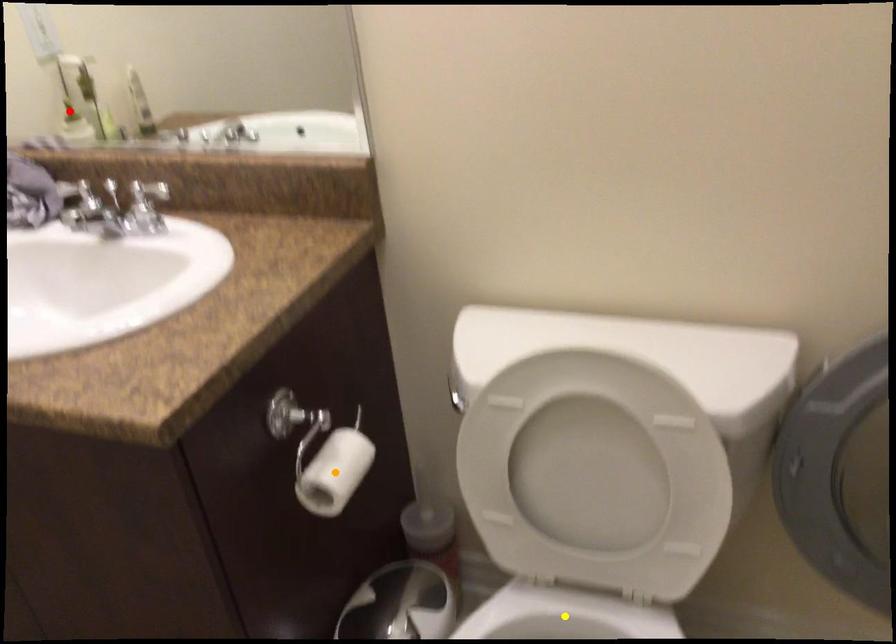
Order these from nearest to farthest:
A) orange point
B) yellow point
C) red point

red point, yellow point, orange point